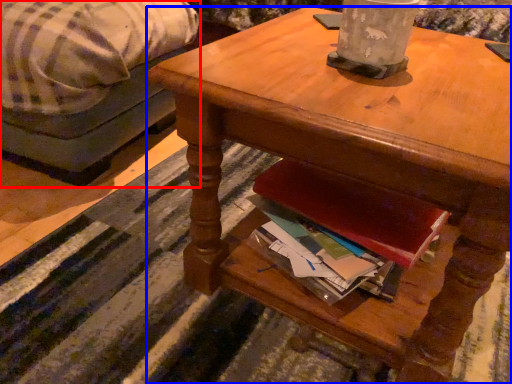
Question: Among these objects, which one is nearest to the camera, studio couch (highlighted by a red box) or desk (highlighted by a blue box)?

Choices:
 (A) studio couch
 (B) desk

Answer: (B)